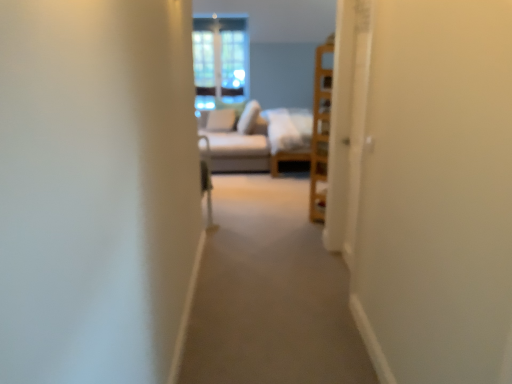
Question: Is clear glass window at center at the right side of white soft pillow at center, the second pillow in the left-to-right sequence?

Choices:
 (A) no
 (B) yes

Answer: (A)

Question: Is clear glass window at center bigger than white soft pillow at center, the second pillow in the left-to-right sequence?

Choices:
 (A) yes
 (B) no

Answer: (B)

Question: Is clear glass window at center positioned with its back to white soft pillow at center, the second pillow in the left-to-right sequence?

Choices:
 (A) yes
 (B) no

Answer: (B)

Question: Can you confirm if clear glass window at center is wider than white soft pillow at center, the second pillow in the left-to-right sequence?

Choices:
 (A) no
 (B) yes

Answer: (A)

Question: Considering the relative positions of clear glass window at center and white soft pillow at center, the second pillow in the left-to-right sequence, in the image provided, is clear glass window at center to the left of white soft pillow at center, the second pillow in the left-to-right sequence, from the viewer's perspective?

Choices:
 (A) no
 (B) yes

Answer: (B)

Question: Could you tell me if clear glass window at center is turned towards white soft pillow at center, the second pillow in the left-to-right sequence?

Choices:
 (A) yes
 (B) no

Answer: (A)

Question: From the image's perspective, does light beige fabric couch at center appear higher than white soft pillow at center, which ranks as the 2th pillow in right-to-left order?

Choices:
 (A) yes
 (B) no

Answer: (B)

Question: From a real-world perspective, is light beige fabric couch at center physically below white soft pillow at center, the 1th pillow viewed from the left?

Choices:
 (A) yes
 (B) no

Answer: (A)

Question: Considering the relative positions of light beige fabric couch at center and white soft pillow at center, the 1th pillow viewed from the left, in the image provided, is light beige fabric couch at center to the left of white soft pillow at center, the 1th pillow viewed from the left, from the viewer's perspective?

Choices:
 (A) no
 (B) yes

Answer: (A)

Question: Does light beige fabric couch at center have a lesser width compared to white soft pillow at center, the 1th pillow viewed from the left?

Choices:
 (A) no
 (B) yes

Answer: (A)

Question: Does light beige fabric couch at center touch white soft pillow at center, which ranks as the 2th pillow in right-to-left order?

Choices:
 (A) yes
 (B) no

Answer: (B)

Question: From a real-world perspective, does light beige fabric couch at center stand above white soft pillow at center, which ranks as the 2th pillow in right-to-left order?

Choices:
 (A) yes
 (B) no

Answer: (B)

Question: Is light beige fabric couch at center bigger than white soft pillow at center, which is the 1th pillow from right to left?

Choices:
 (A) no
 (B) yes

Answer: (B)